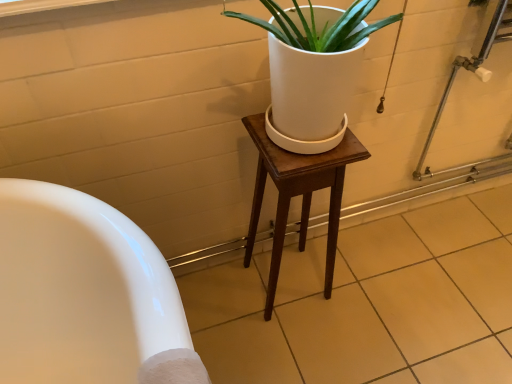
Question: Would you say white glossy tile at lower left contains wooden stool at center?

Choices:
 (A) no
 (B) yes

Answer: (A)

Question: Can you confirm if white glossy tile at lower left is thinner than wooden stool at center?

Choices:
 (A) no
 (B) yes

Answer: (A)

Question: Is white glossy tile at lower left to the left of wooden stool at center from the viewer's perspective?

Choices:
 (A) yes
 (B) no

Answer: (B)

Question: From the image's perspective, would you say white glossy tile at lower left is shown under wooden stool at center?

Choices:
 (A) no
 (B) yes

Answer: (B)

Question: From a real-world perspective, is white glossy tile at lower left under wooden stool at center?

Choices:
 (A) no
 (B) yes

Answer: (B)

Question: Could you tell me if white glossy tile at lower left is turned towards wooden stool at center?

Choices:
 (A) no
 (B) yes

Answer: (A)

Question: Considering the relative sizes of wooden stool at center and white glossy tile at lower left in the image provided, is wooden stool at center shorter than white glossy tile at lower left?

Choices:
 (A) no
 (B) yes

Answer: (A)

Question: From the image's perspective, is wooden stool at center under white glossy tile at lower left?

Choices:
 (A) no
 (B) yes

Answer: (A)

Question: Considering the relative sizes of wooden stool at center and white glossy tile at lower left in the image provided, is wooden stool at center smaller than white glossy tile at lower left?

Choices:
 (A) no
 (B) yes

Answer: (B)

Question: Is wooden stool at center to the right of white glossy tile at lower left from the viewer's perspective?

Choices:
 (A) no
 (B) yes

Answer: (A)

Question: Is wooden stool at center next to white glossy tile at lower left?

Choices:
 (A) no
 (B) yes

Answer: (A)

Question: Would you say wooden stool at center is a long distance from white glossy tile at lower left?

Choices:
 (A) no
 (B) yes

Answer: (A)

Question: Considering the positions of point (328, 266) and point (435, 301), is point (328, 266) closer or farther from the camera than point (435, 301)?

Choices:
 (A) closer
 (B) farther

Answer: (A)